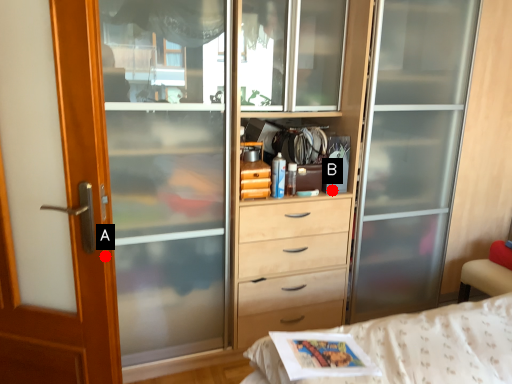
Question: Two points are circled on the image, labeled by A and B beside each circle. Which point appears farthest from the camera in this image?

Choices:
 (A) A is further
 (B) B is further

Answer: (B)